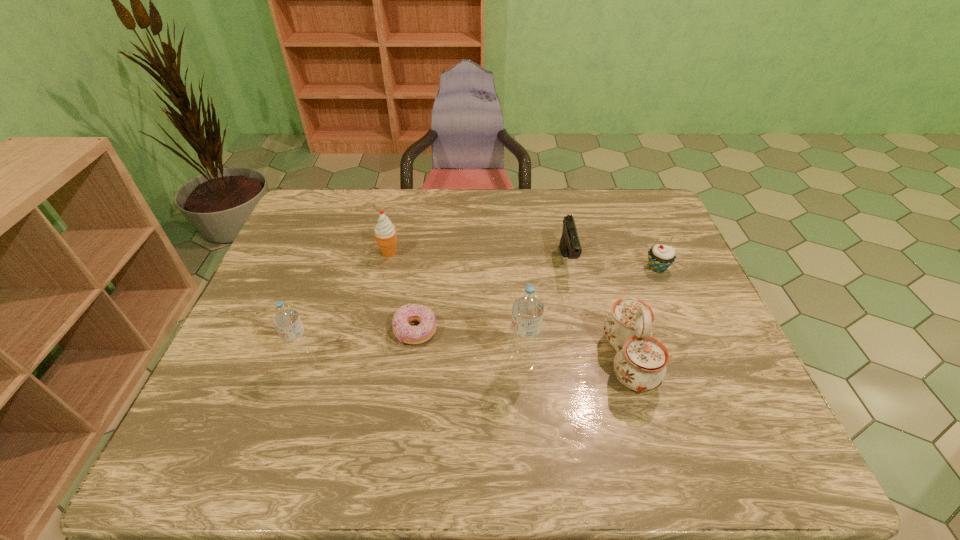
I want to click on vacant position located on the right of the shorter water bottle, so click(485, 361).

I want to click on vacant area situated on the right of the taller water bottle, so click(617, 362).

The height and width of the screenshot is (540, 960). In order to click on vacant space located 0.150m on the left of the icecream in this screenshot , I will do `click(328, 253)`.

The image size is (960, 540). Find the location of `blank area located 0.170m at the barrel of the third object from right to left`. blank area located 0.170m at the barrel of the third object from right to left is located at coordinates pyautogui.click(x=582, y=328).

At what (x,y) coordinates should I click in order to perform the action: click on vacant space situated 0.330m on the right of the fifth object from right to left. Please return your answer as a coordinate pair (x, y). This screenshot has height=540, width=960. Looking at the image, I should click on (567, 331).

At what (x,y) coordinates should I click in order to perform the action: click on free space located on the right of the cupcake. Please return your answer as a coordinate pair (x, y). The width and height of the screenshot is (960, 540). Looking at the image, I should click on (691, 268).

This screenshot has height=540, width=960. What are the coordinates of `vacant space located 0.310m by the handle of the second object from right to left` in the screenshot? It's located at (474, 361).

This screenshot has width=960, height=540. What are the coordinates of `free space located 0.220m by the handle of the second object from right to left` in the screenshot? It's located at (513, 361).

Identify the location of vacant space positioned by the handle of the second object from right to left. The image size is (960, 540). (437, 361).

You are a GUI agent. You are given a task and a screenshot of the screen. Output one action in this format:
    pyautogui.click(x=<x>, y=<y>)
    Task: Click on the object at the near edge
    
    Given the screenshot: What is the action you would take?
    pyautogui.click(x=640, y=362)